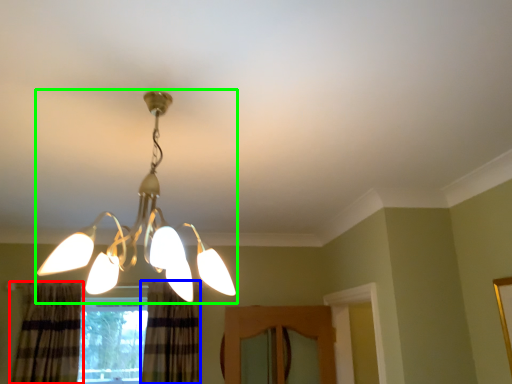
Question: Which is farther away from curtain (highlighted by a red box)? curtain (highlighted by a blue box) or lamp (highlighted by a green box)?

Choices:
 (A) curtain
 (B) lamp

Answer: (B)